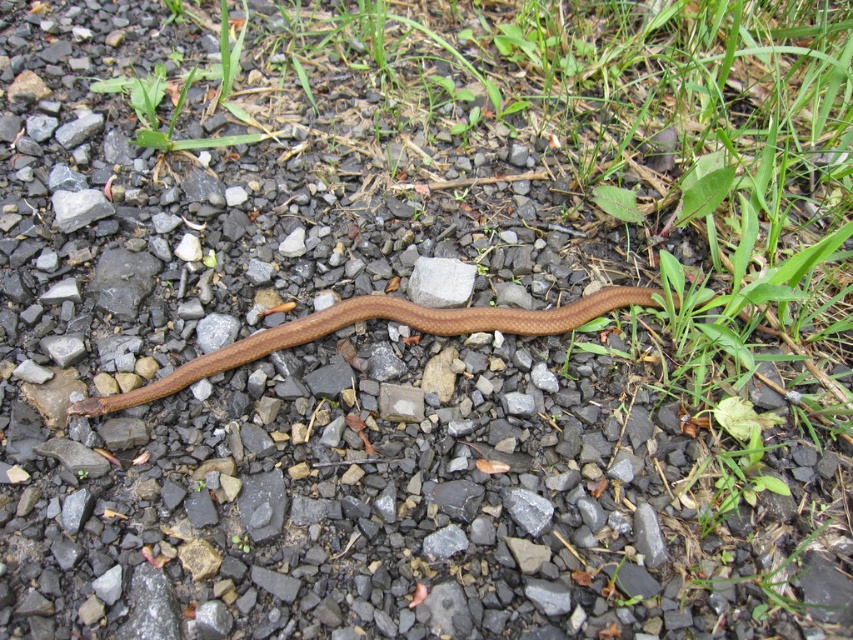
Question: Which object is closer to the camera taking this photo?

Choices:
 (A) brown matte snake at center
 (B) gray smooth rock at center

Answer: (A)

Question: Is brown matte snake at center smaller than gray smooth rock at center?

Choices:
 (A) no
 (B) yes

Answer: (A)

Question: Is the position of brown matte snake at center less distant than that of gray smooth rock at center?

Choices:
 (A) yes
 (B) no

Answer: (A)

Question: Is brown matte snake at center thinner than gray smooth rock at center?

Choices:
 (A) no
 (B) yes

Answer: (A)